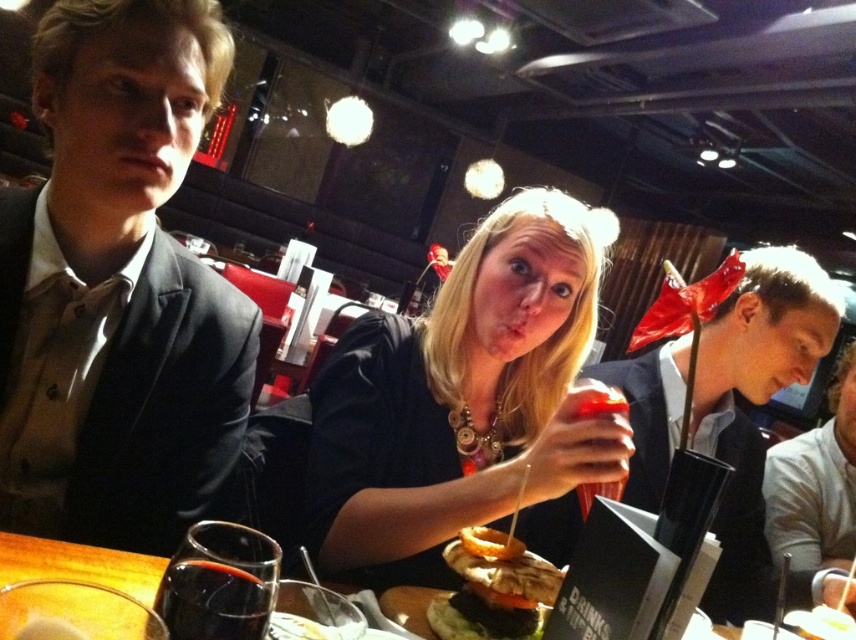
Question: Which point is closer to the camera taking this photo?

Choices:
 (A) (102, 208)
 (B) (107, 548)

Answer: (B)

Question: Which point is farther to the camera?

Choices:
 (A) (72, 467)
 (B) (651, 349)
 (C) (266, 620)
 (D) (554, 576)

Answer: (B)

Question: Is white matte shirt at lower right thinner than wooden table at center?

Choices:
 (A) yes
 (B) no

Answer: (B)

Question: Does matte black suit at left appear under slightly toasted bun at center?

Choices:
 (A) no
 (B) yes

Answer: (A)

Question: Considering the relative positions of white matte shirt at lower right and dark glass beverage at lower left in the image provided, where is white matte shirt at lower right located with respect to dark glass beverage at lower left?

Choices:
 (A) below
 (B) above

Answer: (A)

Question: Which point appears closest to the camera in this image?

Choices:
 (A) (553, 333)
 (B) (817, 355)
 (C) (835, 480)
 (D) (9, 563)

Answer: (D)